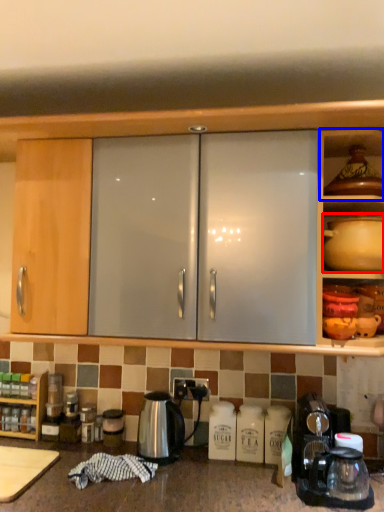
Question: Which point is closer to the camera, coffeepot (highlighted by a red box) or shelf (highlighted by a blue box)?

Choices:
 (A) coffeepot
 (B) shelf

Answer: (A)